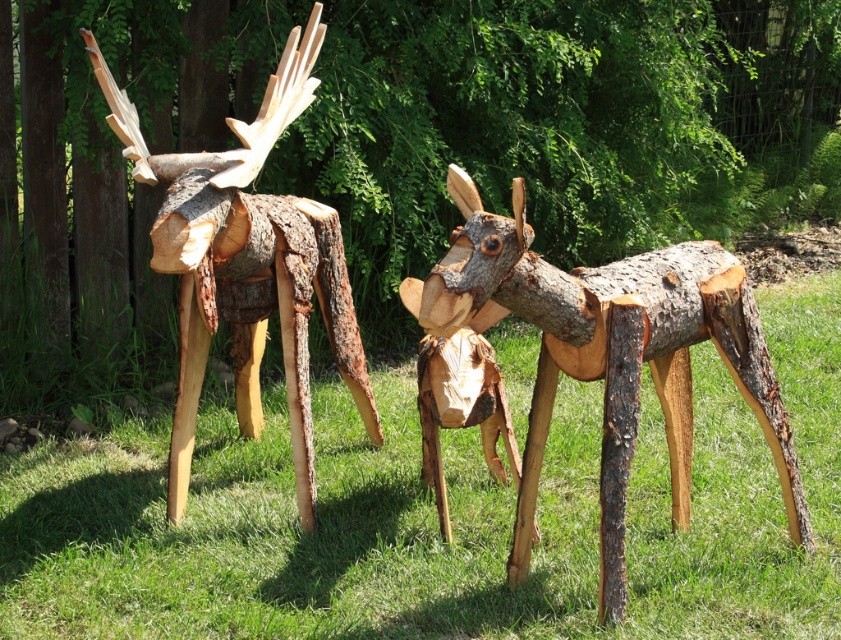
Does green grass at center appear on the left side of natural wood moose at center?

In fact, green grass at center is to the right of natural wood moose at center.

Is green grass at center smaller than natural wood moose at center?

Actually, green grass at center might be larger than natural wood moose at center.

Find the location of a particular element. green grass at center is located at coordinates (435, 518).

You are a GUI agent. You are given a task and a screenshot of the screen. Output one action in this format:
    pyautogui.click(x=<x>, y=<y>)
    Task: Click on the green grass at center
    
    Given the screenshot: What is the action you would take?
    pyautogui.click(x=435, y=518)

Who is more distant from viewer, (x=728, y=269) or (x=194, y=316)?

Positioned behind is point (x=194, y=316).

Does natural wood moose at center appear over natural wood moose at left?

No.

This screenshot has width=841, height=640. What are the coordinates of `natural wood moose at center` in the screenshot? It's located at (601, 356).

Does green grass at center have a greater width compared to natural wood moose at left?

Indeed, green grass at center has a greater width compared to natural wood moose at left.

Is point (829, 435) closer to viewer compared to point (239, 253)?

No, it is behind (239, 253).

The width and height of the screenshot is (841, 640). Identify the location of green grass at center. (435, 518).